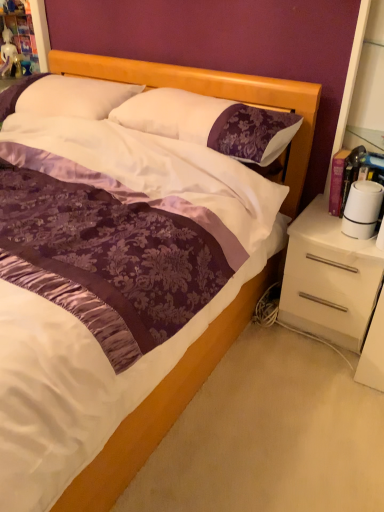
Question: Considering the positions of white satin pillow at upper center, acting as the second pillow starting from the right, and white glossy drawer at right in the image, is white satin pillow at upper center, acting as the second pillow starting from the right, taller or shorter than white glossy drawer at right?

Choices:
 (A) short
 (B) tall

Answer: (A)

Question: Visually, is white satin pillow at upper center, acting as the second pillow starting from the right, positioned to the left or to the right of white glossy drawer at right?

Choices:
 (A) right
 (B) left

Answer: (B)

Question: Estimate the real-world distances between objects in this image. Which object is closer to the purple satin pillow at center, the 1th pillow when ordered from right to left?

Choices:
 (A) white glossy dresser at right
 (B) white glossy drawer at right
 (C) white satin pillow at upper center, acting as the second pillow starting from the right

Answer: (C)

Question: Based on their relative distances, which object is farther from the white glossy drawer at right?

Choices:
 (A) white glossy dresser at right
 (B) white satin pillow at upper center, placed as the first pillow when sorted from left to right
 (C) purple satin pillow at center, the 1th pillow when ordered from right to left

Answer: (B)